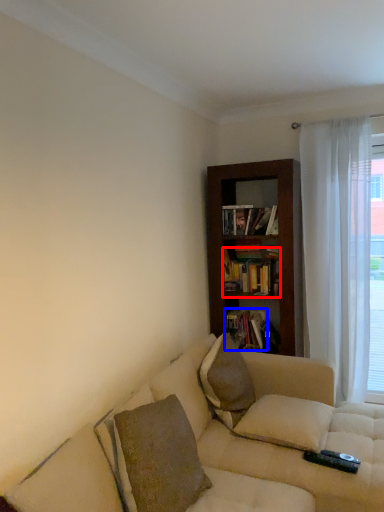
Question: Which of the following is the closest to the observer, book (highlighted by a red box) or book (highlighted by a blue box)?

Choices:
 (A) book
 (B) book

Answer: (A)